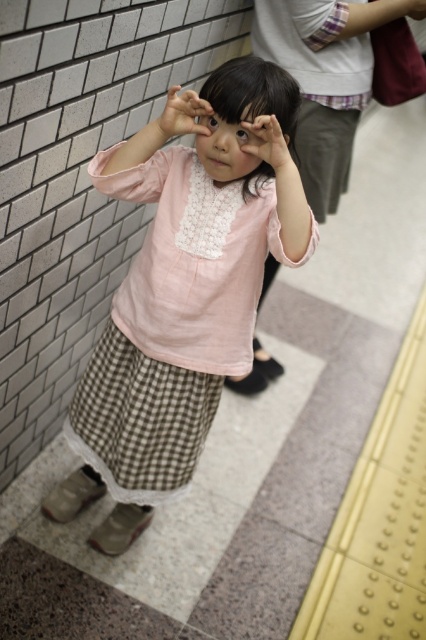
Consider the image. The child in the image is wearing a matte pink shirt at center and has a black glossy eye at center. Which object is positioned higher in the scene?

The black glossy eye at center is positioned higher than the matte pink shirt at center in the scene.

The child in the image is holding their hands in a playful gesture. You are a teacher observing the scene. You need to determine if the space between the matte gray hand at upper center and the black glossy eye at center is wide enough for a small toy car to pass through. The toy car is 10 cm wide. Can the toy car fit through the space between them?

The matte gray hand at upper center might be wider than the black glossy eye at center, but since the exact width difference isn not specified, we cannot determine if the space is wide enough for the 10 cm toy car. More information is needed.